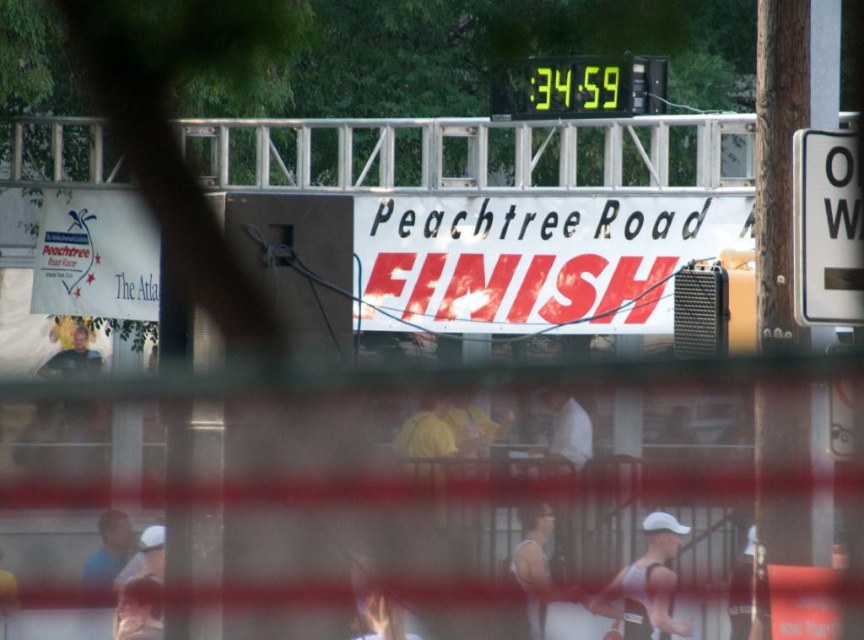
In the scene shown: You are a runner who just finished the race and is standing behind the red barrier tape. You want to check the time displayed on the yellow digital clock at upper center. However, the white fabric at center is blocking your view. Can you see the time clearly?

The yellow digital clock at upper center is positioned on the right side of white fabric at center, so the white fabric at center is blocking the view of the yellow digital clock at upper center. Therefore, you cannot see the time clearly.